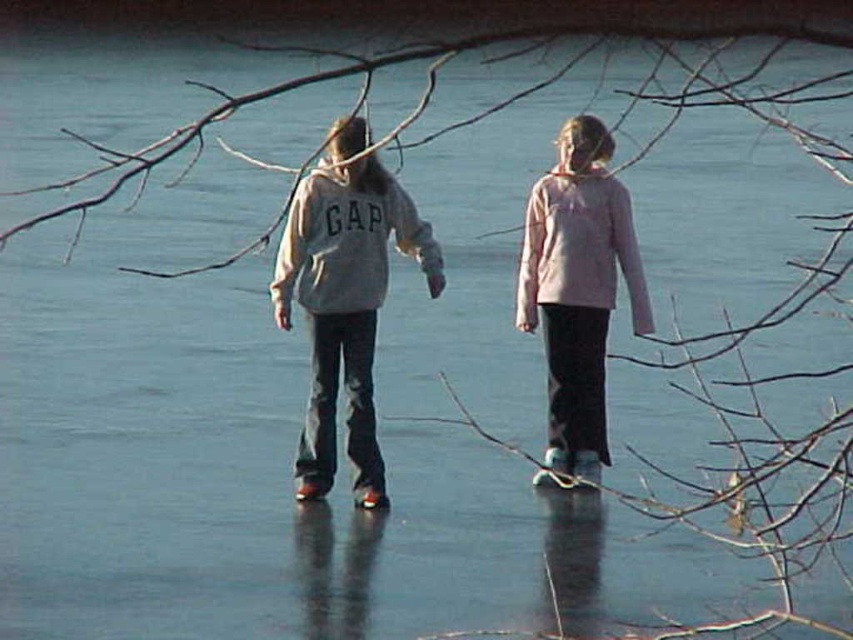
You are standing at the origin point of the image coordinate system. Which object is located at the coordinates point (345, 300)?

The gray cotton hoodie at center is located at the coordinates point (345, 300).

You are a clothing store manager who needs to display the gray cotton hoodie at center and the pink fleece sweatshirt at center on a single mannequin. Since the mannequin can only fit one size, which one should you choose to ensure it fits properly?

The gray cotton hoodie at center has a larger size compared to the pink fleece sweatshirt at center, so you should choose the gray cotton hoodie at center to ensure it fits properly on the mannequin.